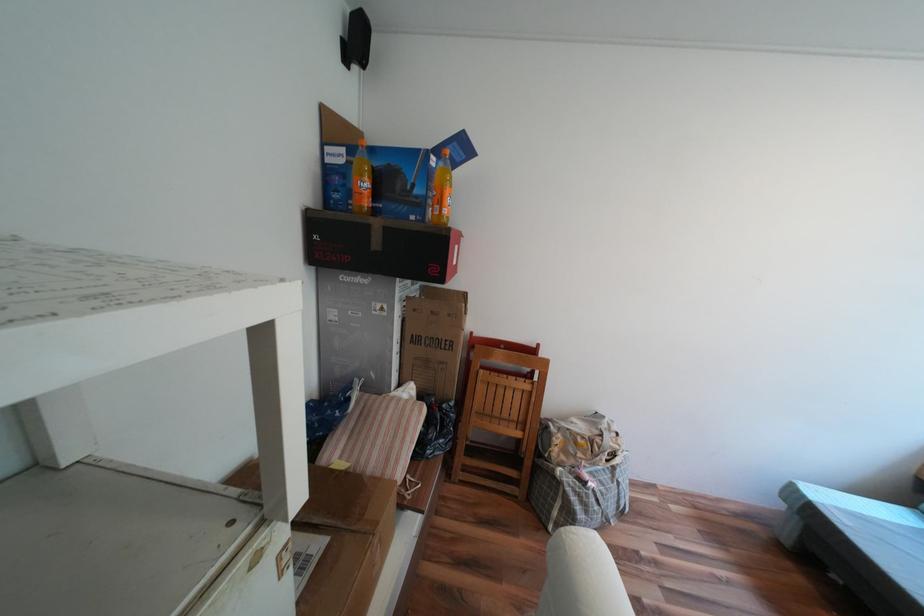
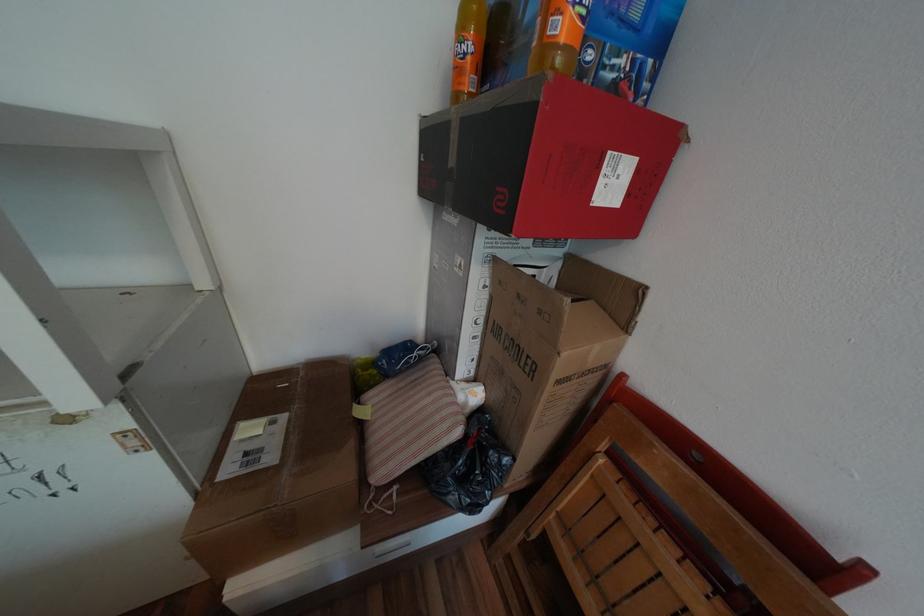
Question: Based on the continuous images, in which direction is the camera rotating? Reply with the corresponding letter.

Choices:
 (A) Left
 (B) Right
 (C) Up
 (D) Down

Answer: (A)